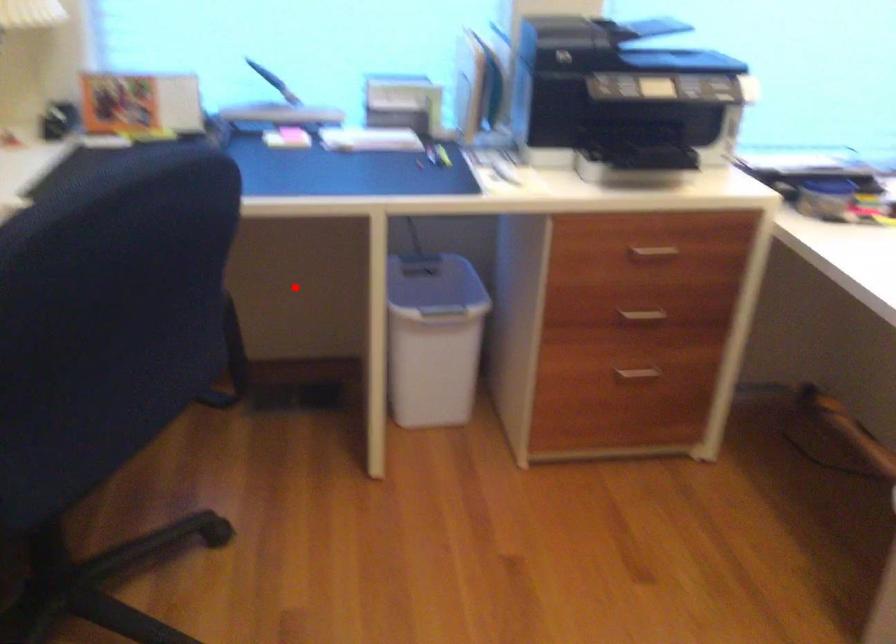
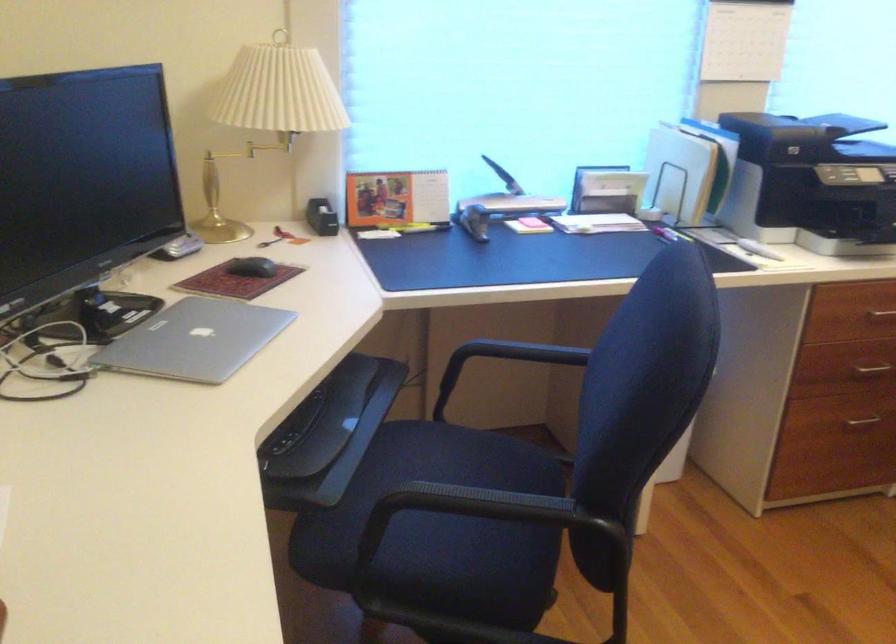
Locate, in the second image, the point that corresponds to the highlighted location in the first image.

(502, 362)